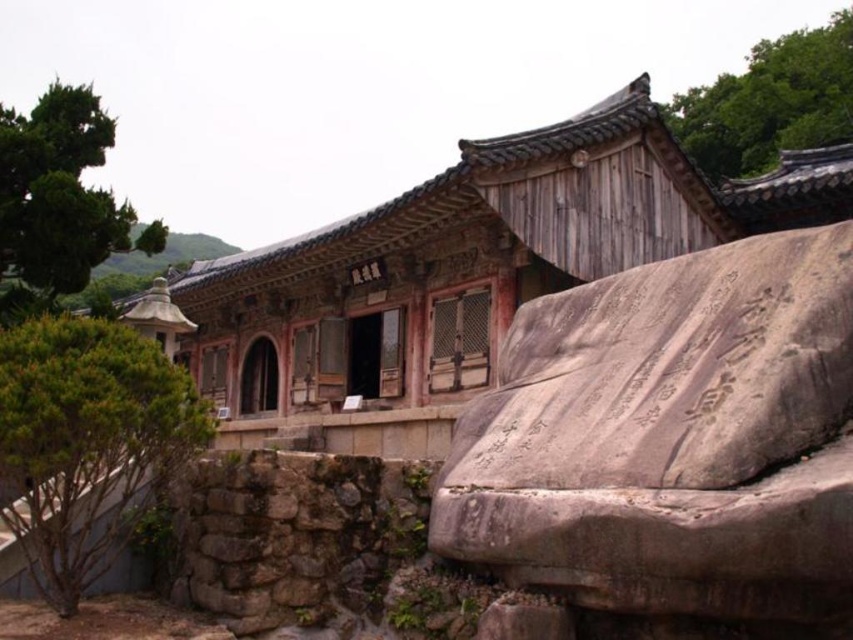
Based on the photo, you are standing in front of the traditional Korean building and notice two plants in the scene. Which one, the green leafy bush at lower left or the green leafy tree at upper left, is closer to you?

The green leafy bush at lower left is closer to you because it is in front of the green leafy tree at upper left.

You are standing at the center of the image and want to find the green leafy bush at lower left. Which direction should you look to locate it?

You should look to the lower left direction to find the green leafy bush at lower left, as it is located at point coordinates of (86, 442).